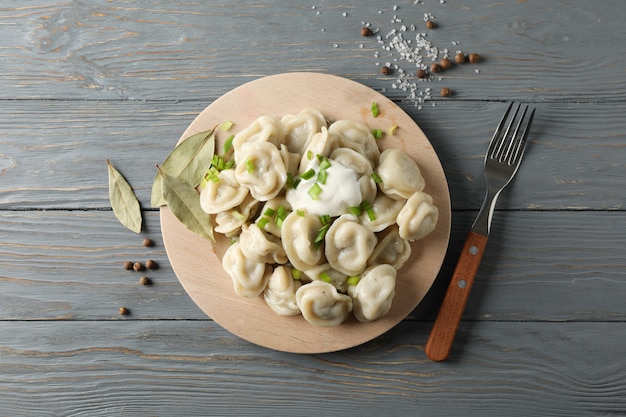
The width and height of the screenshot is (626, 417). Find the location of `wood plate`. wood plate is located at coordinates (330, 99).